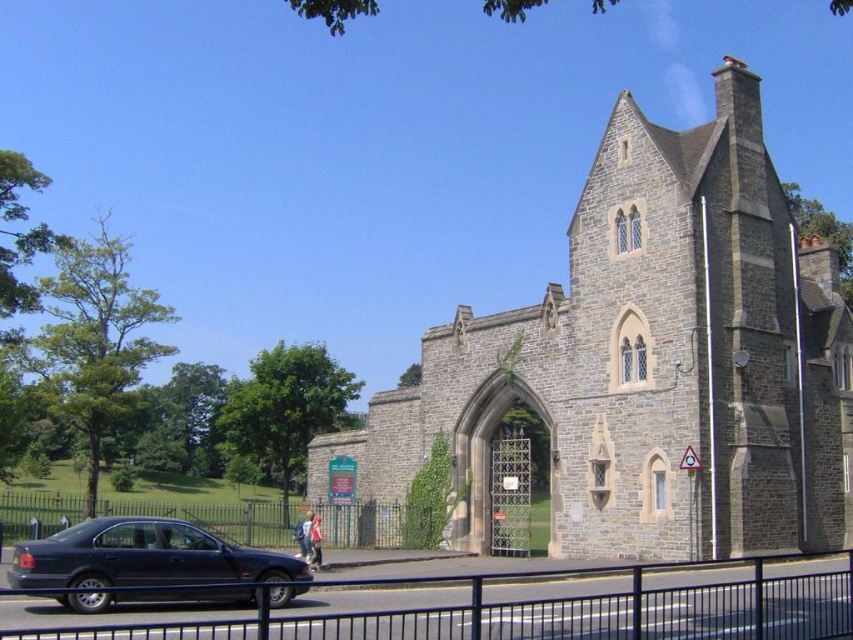
You are a delivery person approaching the historic stone building and need to enter through the gate. You see the metallic blue fence at lower center and the green metal fence at lower center. Which fence is the smaller one you should pass through?

The metallic blue fence at lower center is smaller than the green metal fence at lower center, so you should pass through the metallic blue fence at lower center.